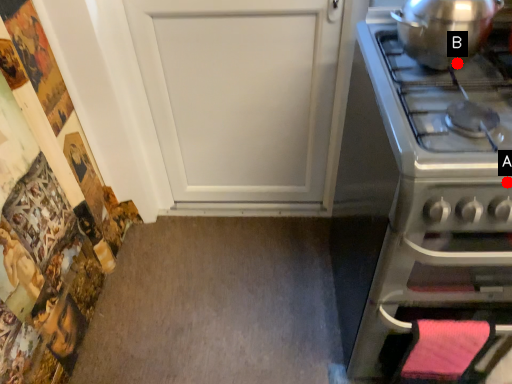
Question: Two points are circled on the image, labeled by A and B beside each circle. Which of the following is the farthest from the observer?

Choices:
 (A) A is further
 (B) B is further

Answer: (B)